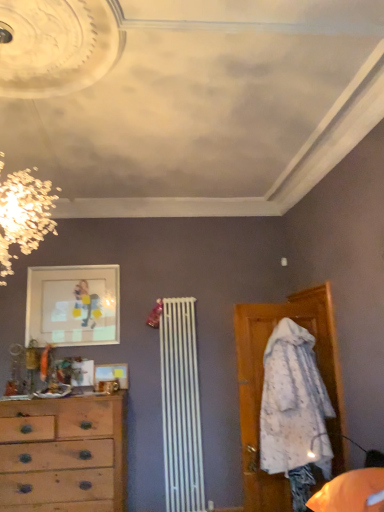
Identify the location of wooden chest of drawers at left. Image resolution: width=384 pixels, height=512 pixels. (64, 454).

This screenshot has height=512, width=384. What do you see at coordinates (111, 374) in the screenshot? I see `wooden picture frame at center, which is the 2th picture frame from top to bottom` at bounding box center [111, 374].

You are a GUI agent. You are given a task and a screenshot of the screen. Output one action in this format:
    pyautogui.click(x=<x>, y=<y>)
    Task: Click on the matte glass picture frame at upper left, positioned as the 1th picture frame in top-to-bottom order
    This screenshot has width=384, height=512.
    Given the screenshot: What is the action you would take?
    pyautogui.click(x=73, y=305)

Identify the location of wooden chest of drawers at left. The image size is (384, 512). (64, 454).

In the scene shown: Considering the relative sizes of wooden chest of drawers at left and matte glass picture frame at upper left, positioned as the 1th picture frame in top-to-bottom order, in the image provided, is wooden chest of drawers at left shorter than matte glass picture frame at upper left, positioned as the 1th picture frame in top-to-bottom order,?

No, wooden chest of drawers at left is not shorter than matte glass picture frame at upper left, positioned as the 1th picture frame in top-to-bottom order.

Considering the relative sizes of wooden chest of drawers at left and matte glass picture frame at upper left, positioned as the 1th picture frame in top-to-bottom order, in the image provided, is wooden chest of drawers at left thinner than matte glass picture frame at upper left, positioned as the 1th picture frame in top-to-bottom order,?

Incorrect, the width of wooden chest of drawers at left is not less than that of matte glass picture frame at upper left, positioned as the 1th picture frame in top-to-bottom order.

Is wooden chest of drawers at left touching matte glass picture frame at upper left, positioned as the 1th picture frame in top-to-bottom order?

There is a gap between wooden chest of drawers at left and matte glass picture frame at upper left, positioned as the 1th picture frame in top-to-bottom order.

Does wooden chest of drawers at left lie in front of matte glass picture frame at upper left, the 2th picture frame in the bottom-to-top sequence?

Yes, the depth of wooden chest of drawers at left is less than that of matte glass picture frame at upper left, the 2th picture frame in the bottom-to-top sequence.

From a real-world perspective, is wooden picture frame at center, which is the 2th picture frame from top to bottom, physically above matte glass picture frame at upper left, positioned as the 1th picture frame in top-to-bottom order?

No, from a real-world perspective, wooden picture frame at center, which is the 2th picture frame from top to bottom, is not over matte glass picture frame at upper left, positioned as the 1th picture frame in top-to-bottom order

Is wooden picture frame at center, the 1th picture frame from the bottom, facing away from matte glass picture frame at upper left, the 2th picture frame in the bottom-to-top sequence?

No.

Is matte glass picture frame at upper left, the 2th picture frame in the bottom-to-top sequence, located within wooden picture frame at center, which is the 2th picture frame from top to bottom?

No, wooden picture frame at center, which is the 2th picture frame from top to bottom, does not contain matte glass picture frame at upper left, the 2th picture frame in the bottom-to-top sequence.

Considering the sizes of objects wooden picture frame at center, the 1th picture frame from the bottom, and matte glass picture frame at upper left, positioned as the 1th picture frame in top-to-bottom order, in the image provided, who is shorter, wooden picture frame at center, the 1th picture frame from the bottom, or matte glass picture frame at upper left, positioned as the 1th picture frame in top-to-bottom order,?

With less height is wooden picture frame at center, the 1th picture frame from the bottom.

Between wooden picture frame at center, which is the 2th picture frame from top to bottom, and wooden chest of drawers at left, which one has more height?

wooden chest of drawers at left is taller.

What's the angular difference between wooden picture frame at center, the 1th picture frame from the bottom, and wooden chest of drawers at left's facing directions?

The facing directions of wooden picture frame at center, the 1th picture frame from the bottom, and wooden chest of drawers at left are 1.62 degrees apart.

From a real-world perspective, does wooden picture frame at center, which is the 2th picture frame from top to bottom, sit lower than wooden chest of drawers at left?

Incorrect, from a real-world perspective, wooden picture frame at center, which is the 2th picture frame from top to bottom, is higher than wooden chest of drawers at left.

Is wooden picture frame at center, the 1th picture frame from the bottom, closer to the viewer compared to wooden chest of drawers at left?

No, wooden picture frame at center, the 1th picture frame from the bottom, is further to the viewer.

Who is taller, matte glass picture frame at upper left, positioned as the 1th picture frame in top-to-bottom order, or wooden picture frame at center, which is the 2th picture frame from top to bottom?

With more height is matte glass picture frame at upper left, positioned as the 1th picture frame in top-to-bottom order.

Is wooden picture frame at center, which is the 2th picture frame from top to bottom, surrounded by matte glass picture frame at upper left, positioned as the 1th picture frame in top-to-bottom order?

No, wooden picture frame at center, which is the 2th picture frame from top to bottom, is not a part of matte glass picture frame at upper left, positioned as the 1th picture frame in top-to-bottom order.

Considering the positions of objects matte glass picture frame at upper left, positioned as the 1th picture frame in top-to-bottom order, and wooden picture frame at center, which is the 2th picture frame from top to bottom, in the image provided, who is more to the right, matte glass picture frame at upper left, positioned as the 1th picture frame in top-to-bottom order, or wooden picture frame at center, which is the 2th picture frame from top to bottom,?

Positioned to the right is wooden picture frame at center, which is the 2th picture frame from top to bottom.

Which point is more forward, (96, 280) or (112, 374)?

The point (112, 374) is closer to the camera.

Who is taller, wooden chest of drawers at left or wooden picture frame at center, the 1th picture frame from the bottom?

wooden chest of drawers at left is taller.

Which object is wider, wooden chest of drawers at left or wooden picture frame at center, the 1th picture frame from the bottom?

wooden chest of drawers at left.

Would you say matte glass picture frame at upper left, positioned as the 1th picture frame in top-to-bottom order, is outside wooden chest of drawers at left?

That's correct, matte glass picture frame at upper left, positioned as the 1th picture frame in top-to-bottom order, is outside of wooden chest of drawers at left.

Is the depth of matte glass picture frame at upper left, positioned as the 1th picture frame in top-to-bottom order, greater than that of wooden chest of drawers at left?

Yes, matte glass picture frame at upper left, positioned as the 1th picture frame in top-to-bottom order, is behind wooden chest of drawers at left.

Which of these two, matte glass picture frame at upper left, the 2th picture frame in the bottom-to-top sequence, or wooden chest of drawers at left, is bigger?

With larger size is wooden chest of drawers at left.

This screenshot has height=512, width=384. Find the location of `the chest of drawers beneath the matte glass picture frame at upper left, positioned as the 1th picture frame in top-to-bottom order (from a real-world perspective)`. the chest of drawers beneath the matte glass picture frame at upper left, positioned as the 1th picture frame in top-to-bottom order (from a real-world perspective) is located at coordinates (64, 454).

The height and width of the screenshot is (512, 384). Find the location of `picture frame on the left of wooden picture frame at center, which is the 2th picture frame from top to bottom`. picture frame on the left of wooden picture frame at center, which is the 2th picture frame from top to bottom is located at coordinates (73, 305).

Estimate the real-world distances between objects in this image. Which object is closer to wooden chest of drawers at left, matte glass picture frame at upper left, positioned as the 1th picture frame in top-to-bottom order, or wooden picture frame at center, which is the 2th picture frame from top to bottom?

Based on the image, wooden picture frame at center, which is the 2th picture frame from top to bottom, appears to be nearer to wooden chest of drawers at left.

From the image, which object appears to be farther from wooden picture frame at center, the 1th picture frame from the bottom, matte glass picture frame at upper left, the 2th picture frame in the bottom-to-top sequence, or wooden chest of drawers at left?

The object further to wooden picture frame at center, the 1th picture frame from the bottom, is matte glass picture frame at upper left, the 2th picture frame in the bottom-to-top sequence.

From the image, which object appears to be farther from wooden picture frame at center, the 1th picture frame from the bottom, wooden chest of drawers at left or matte glass picture frame at upper left, positioned as the 1th picture frame in top-to-bottom order?

Based on the image, matte glass picture frame at upper left, positioned as the 1th picture frame in top-to-bottom order, appears to be further to wooden picture frame at center, the 1th picture frame from the bottom.

Which object lies nearer to the anchor point wooden chest of drawers at left, wooden picture frame at center, which is the 2th picture frame from top to bottom, or matte glass picture frame at upper left, positioned as the 1th picture frame in top-to-bottom order?

wooden picture frame at center, which is the 2th picture frame from top to bottom.

Estimate the real-world distances between objects in this image. Which object is closer to matte glass picture frame at upper left, the 2th picture frame in the bottom-to-top sequence, wooden chest of drawers at left or wooden picture frame at center, which is the 2th picture frame from top to bottom?

wooden picture frame at center, which is the 2th picture frame from top to bottom.

Which object lies nearer to the anchor point matte glass picture frame at upper left, positioned as the 1th picture frame in top-to-bottom order, wooden picture frame at center, the 1th picture frame from the bottom, or wooden chest of drawers at left?

The object closer to matte glass picture frame at upper left, positioned as the 1th picture frame in top-to-bottom order, is wooden picture frame at center, the 1th picture frame from the bottom.

Identify the location of picture frame between matte glass picture frame at upper left, positioned as the 1th picture frame in top-to-bottom order, and wooden chest of drawers at left vertically. The image size is (384, 512). [x=111, y=374].